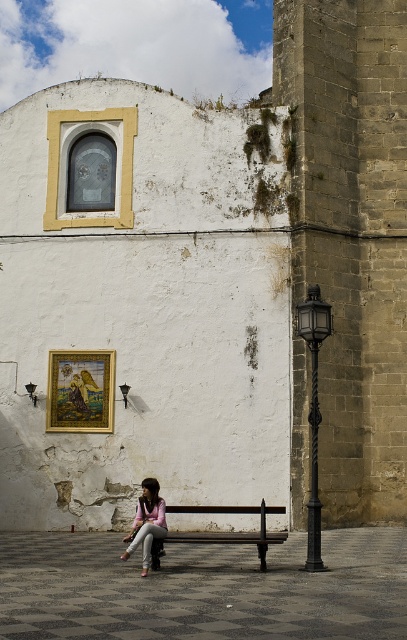
You are a tourist standing in front of the wooden bench at center. You want to take a photo of the black wrought iron streetlight at right without the bench appearing in the background. Is this possible?

The wooden bench at center is behind the black wrought iron streetlight at right, so if you position yourself in front of the streetlight, the bench will be behind the streetlight and not visible in the photo background.

You are standing at the point marked by the coordinates (313, 410) in the image. What object is located exactly at this point?

The black wrought iron streetlight at right is located exactly at point (313, 410).